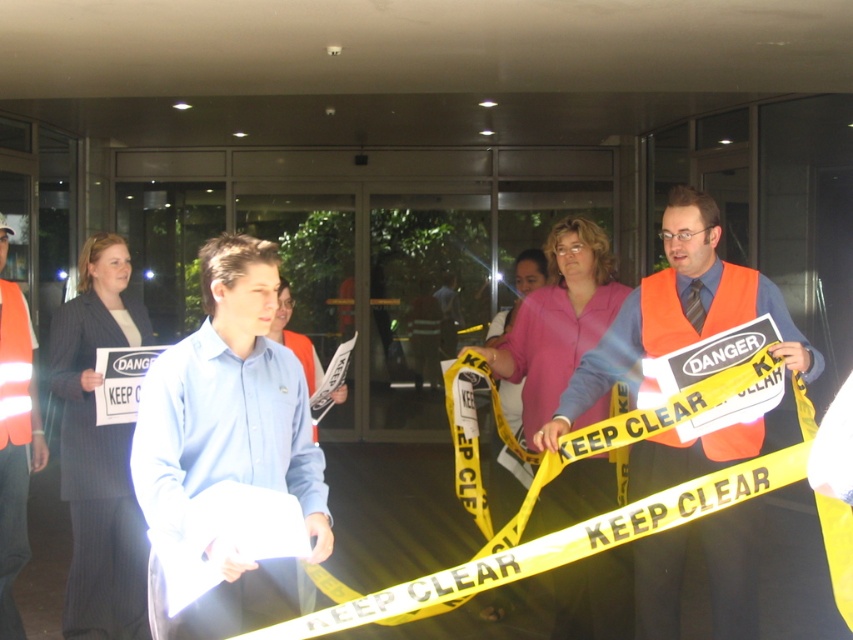
Question: Does blue shirt at center have a smaller size compared to high-visibility reflective vest at center?

Choices:
 (A) yes
 (B) no

Answer: (B)

Question: Is orange reflective vest at center to the right of high-visibility reflective vest at center from the viewer's perspective?

Choices:
 (A) yes
 (B) no

Answer: (A)

Question: Does blue shirt at center appear over orange reflective vest at center?

Choices:
 (A) yes
 (B) no

Answer: (A)

Question: Which object is closer to the camera taking this photo?

Choices:
 (A) orange reflective vest at center
 (B) blue shirt at center
 (C) high-visibility reflective vest at center

Answer: (B)

Question: Which point is farther from the camera taking this photo?

Choices:
 (A) (676, 611)
 (B) (0, 600)

Answer: (B)

Question: Which of these objects is positioned farthest from the orange reflective vest at center?

Choices:
 (A) blue shirt at center
 (B) high-visibility reflective vest at center

Answer: (B)